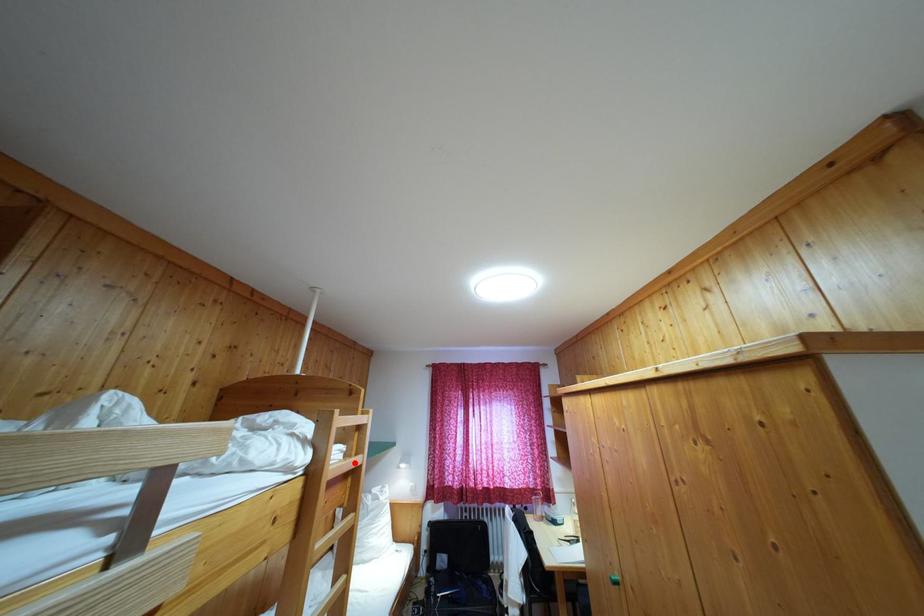
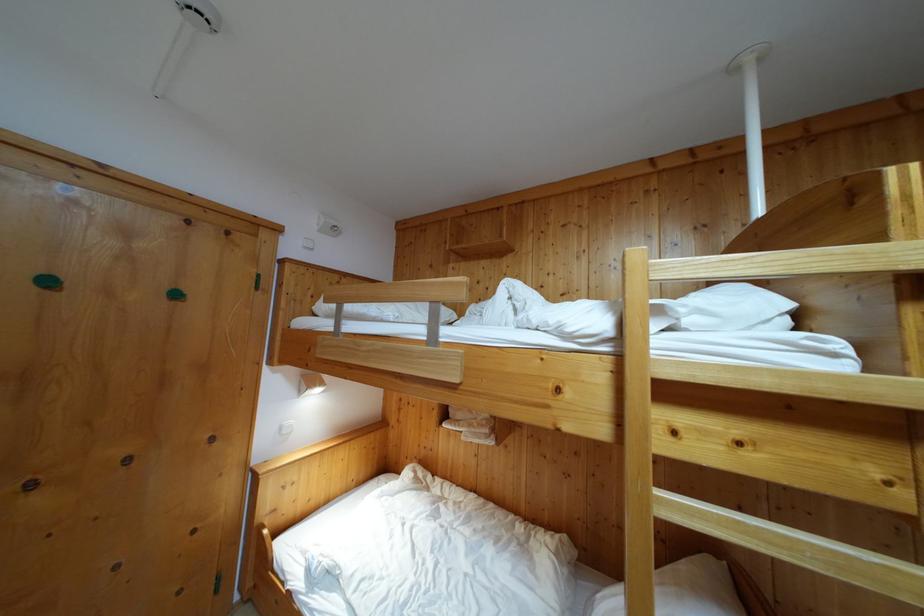
Question: I am providing you with two images of the same scene from different viewpoints. A red point is shown in image1. For the corresponding object point in image2, is it positioned nearer or farther from the camera?

Choices:
 (A) Nearer
 (B) Farther

Answer: (A)